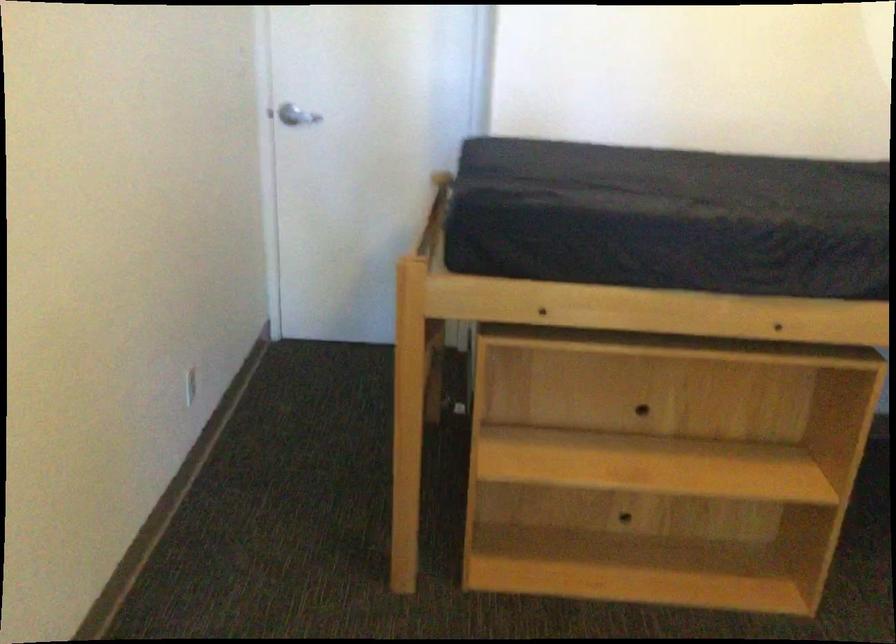
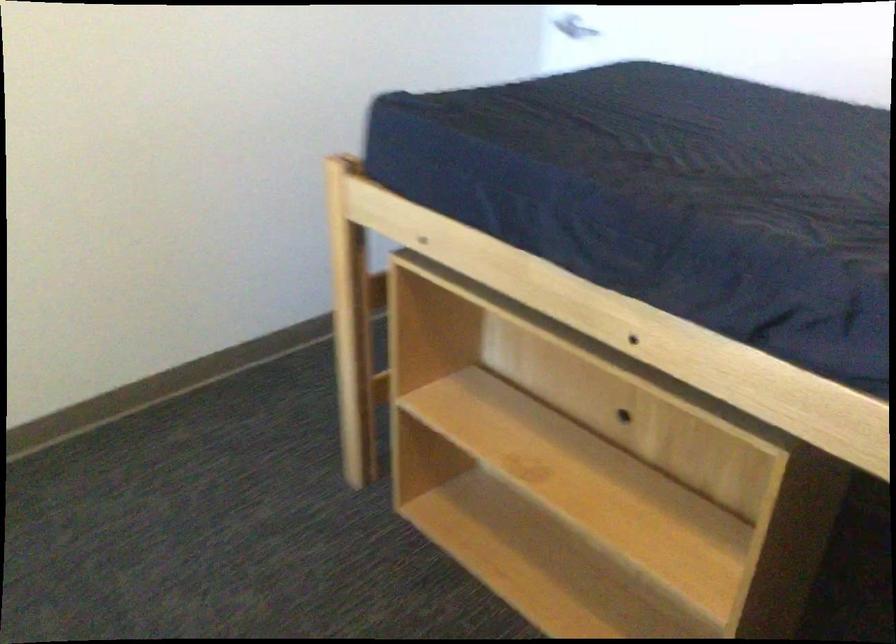
Question: I am providing you with two images of the same scene from different viewpoints. Please identify which objects are invisible in image2.

Choices:
 (A) dark blue mattress
 (B) wooden ladder rung
 (C) drawer pull hole
 (D) blue jug handle

Answer: (C)